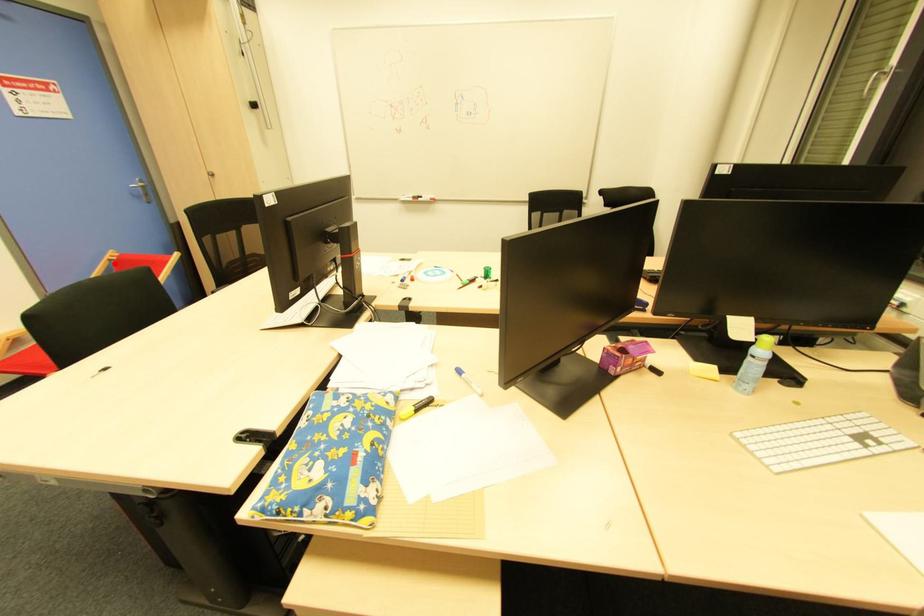
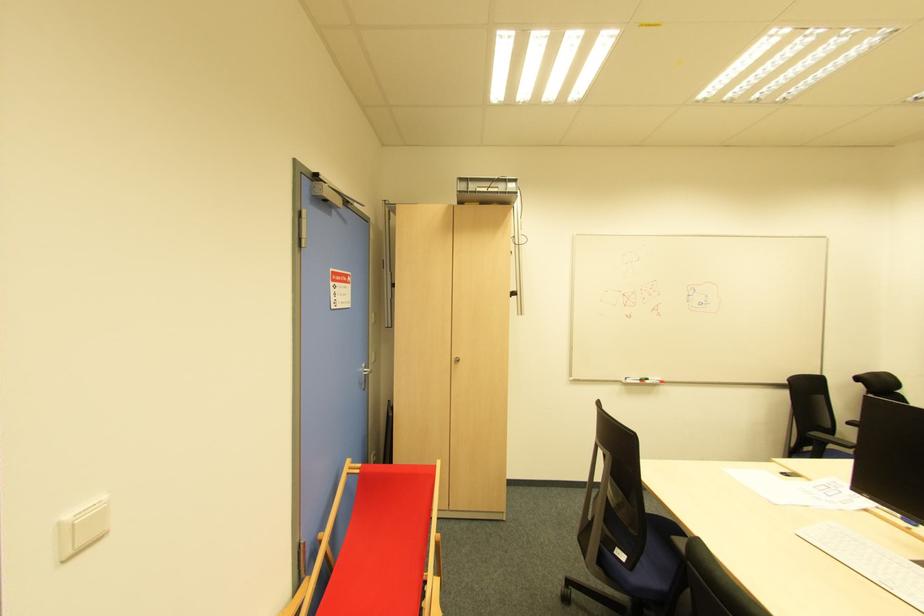
Where in the second image is the point corresponding to the highlighted location from the first image?

(357, 477)